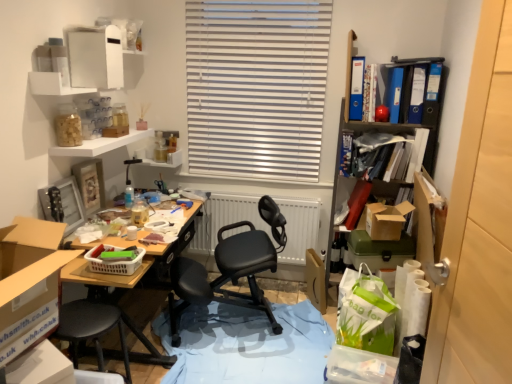
Question: From the image's perspective, is matte red book at right, which appears as the 5th book when viewed from the right, beneath blue glossy file at upper right, placed as the third book when sorted from right to left?

Choices:
 (A) yes
 (B) no

Answer: (A)

Question: From the image's perspective, would you say matte red book at right, which appears as the 5th book when viewed from the right, is positioned over blue glossy file at upper right, placed as the third book when sorted from right to left?

Choices:
 (A) yes
 (B) no

Answer: (B)

Question: Is matte red book at right, placed as the third book when sorted from left to right, positioned far away from blue glossy file at upper right, placed as the third book when sorted from right to left?

Choices:
 (A) yes
 (B) no

Answer: (B)

Question: Is matte red book at right, placed as the third book when sorted from left to right, thinner than blue glossy file at upper right, which is counted as the fifth book, starting from the left?

Choices:
 (A) no
 (B) yes

Answer: (A)

Question: From a real-world perspective, is matte red book at right, which appears as the 5th book when viewed from the right, under blue glossy file at upper right, which is counted as the fifth book, starting from the left?

Choices:
 (A) no
 (B) yes

Answer: (B)

Question: From a real-world perspective, is matte red book at right, which appears as the 5th book when viewed from the right, physically above blue glossy file at upper right, which is counted as the fifth book, starting from the left?

Choices:
 (A) yes
 (B) no

Answer: (B)

Question: Is the depth of blue matte book at upper right, placed as the 7th book when sorted from right to left, greater than that of plastic basket at center?

Choices:
 (A) yes
 (B) no

Answer: (A)

Question: Is blue matte book at upper right, acting as the 1th book starting from the left, not inside plastic basket at center?

Choices:
 (A) no
 (B) yes

Answer: (B)

Question: Does blue matte book at upper right, acting as the 1th book starting from the left, have a greater height compared to plastic basket at center?

Choices:
 (A) no
 (B) yes

Answer: (B)

Question: Does blue matte book at upper right, placed as the 7th book when sorted from right to left, contain plastic basket at center?

Choices:
 (A) no
 (B) yes

Answer: (A)

Question: Can you confirm if blue matte book at upper right, acting as the 1th book starting from the left, is smaller than plastic basket at center?

Choices:
 (A) yes
 (B) no

Answer: (B)

Question: From the image's perspective, is blue matte book at upper right, placed as the 7th book when sorted from right to left, under plastic basket at center?

Choices:
 (A) no
 (B) yes

Answer: (A)

Question: Does blue glossy file at upper right, which is the sixth book from left to right, turn towards blue plastic ring binder at upper right, placed as the second book when sorted from left to right?

Choices:
 (A) yes
 (B) no

Answer: (B)